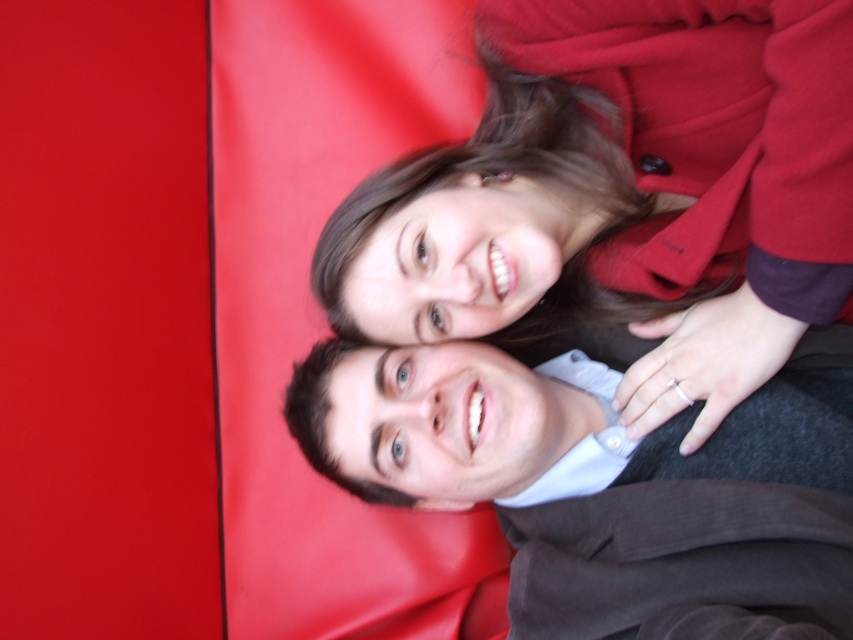
Can you confirm if matte red coat at upper center is bigger than smooth brown jacket at lower right?

Yes.

Does matte red coat at upper center have a greater width compared to smooth brown jacket at lower right?

No.

Who is more distant from viewer, (700, 346) or (764, 582)?

The point (700, 346) is more distant.

You are a GUI agent. You are given a task and a screenshot of the screen. Output one action in this format:
    pyautogui.click(x=<x>, y=<y>)
    Task: Click on the matte red coat at upper center
    This screenshot has height=640, width=853.
    Given the screenshot: What is the action you would take?
    pyautogui.click(x=624, y=192)